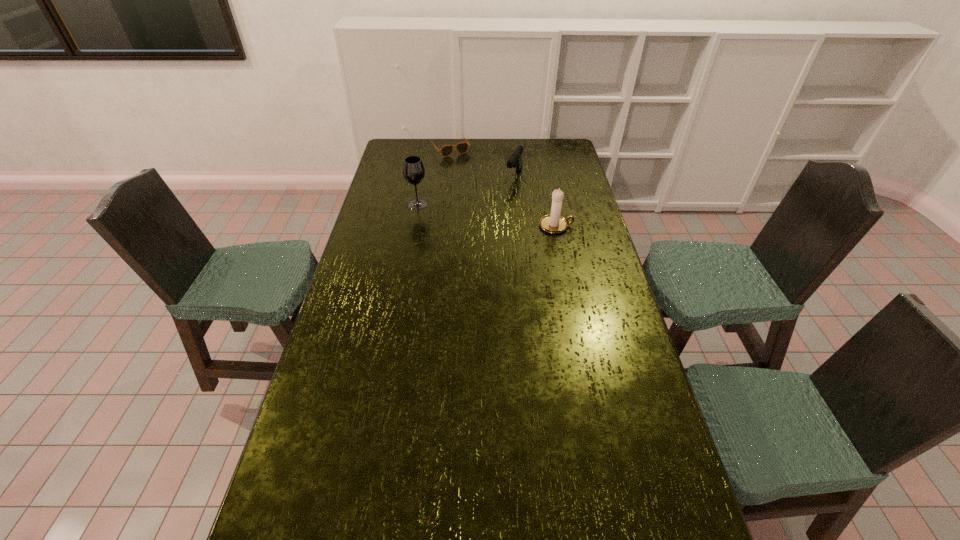
Identify the location of the tallest object. Image resolution: width=960 pixels, height=540 pixels. (413, 170).

Identify the location of the second nearest object. pos(413,170).

At what (x,y) coordinates should I click in order to perform the action: click on the rightmost object. Please return your answer as a coordinate pair (x, y). The image size is (960, 540). Looking at the image, I should click on (554, 223).

Locate an element on the screen. the third shortest object is located at coordinates (554, 223).

Find the location of a particular element. This screenshot has height=540, width=960. the second shortest object is located at coordinates (515, 161).

The image size is (960, 540). Identify the location of the third nearest object. (515, 161).

What are the coordinates of `the shortest object` in the screenshot? It's located at (462, 147).

This screenshot has height=540, width=960. Identify the location of the farthest object. (462, 147).

The image size is (960, 540). Identify the location of vacant space situated on the back of the tallest object. (422, 177).

Identify the location of vacant region located on the front-facing side of the pistol. (498, 204).